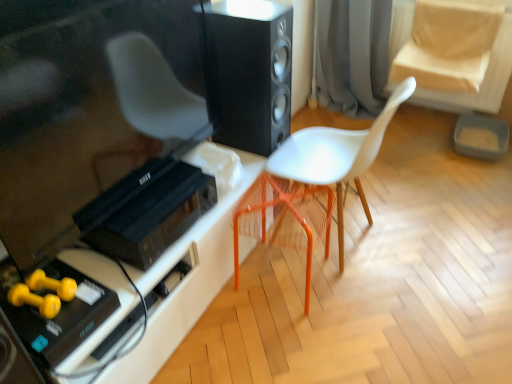
Question: Can you confirm if white matte chair at center is taller than white plastic table at lower left?

Choices:
 (A) yes
 (B) no

Answer: (A)

Question: From the image's perspective, is white matte chair at center on top of white plastic table at lower left?

Choices:
 (A) yes
 (B) no

Answer: (A)

Question: Is white matte chair at center oriented away from white plastic table at lower left?

Choices:
 (A) yes
 (B) no

Answer: (B)

Question: Is white matte chair at center closer to the viewer compared to white plastic table at lower left?

Choices:
 (A) yes
 (B) no

Answer: (B)

Question: Is white matte chair at center next to white plastic table at lower left and touching it?

Choices:
 (A) no
 (B) yes

Answer: (A)

Question: Is white matte chair at center further to the viewer compared to white plastic table at lower left?

Choices:
 (A) no
 (B) yes

Answer: (B)

Question: Is orange plastic swivel chair at center shorter than white plastic table at lower left?

Choices:
 (A) no
 (B) yes

Answer: (A)

Question: Can you confirm if orange plastic swivel chair at center is wider than white plastic table at lower left?

Choices:
 (A) no
 (B) yes

Answer: (A)

Question: Is orange plastic swivel chair at center positioned beyond the bounds of white plastic table at lower left?

Choices:
 (A) yes
 (B) no

Answer: (A)

Question: Are orange plastic swivel chair at center and white plastic table at lower left located far from each other?

Choices:
 (A) yes
 (B) no

Answer: (B)

Question: Does orange plastic swivel chair at center have a lesser width compared to white plastic table at lower left?

Choices:
 (A) no
 (B) yes

Answer: (B)

Question: From a real-world perspective, is orange plastic swivel chair at center located higher than white plastic table at lower left?

Choices:
 (A) no
 (B) yes

Answer: (B)

Question: From a real-world perspective, is black plastic stereo at lower left on top of gray fabric curtain at upper center?

Choices:
 (A) yes
 (B) no

Answer: (A)